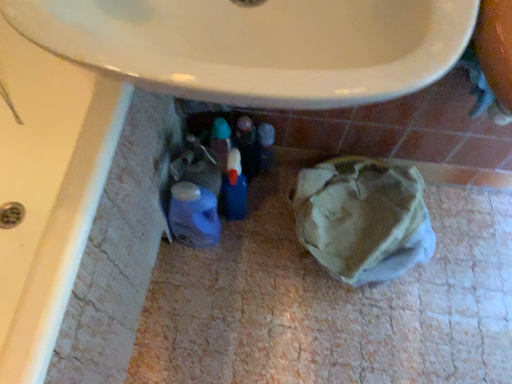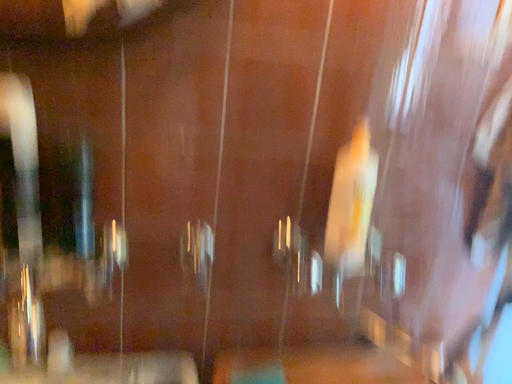
Question: How did the camera likely rotate when shooting the video?

Choices:
 (A) rotated downward
 (B) rotated upward

Answer: (B)